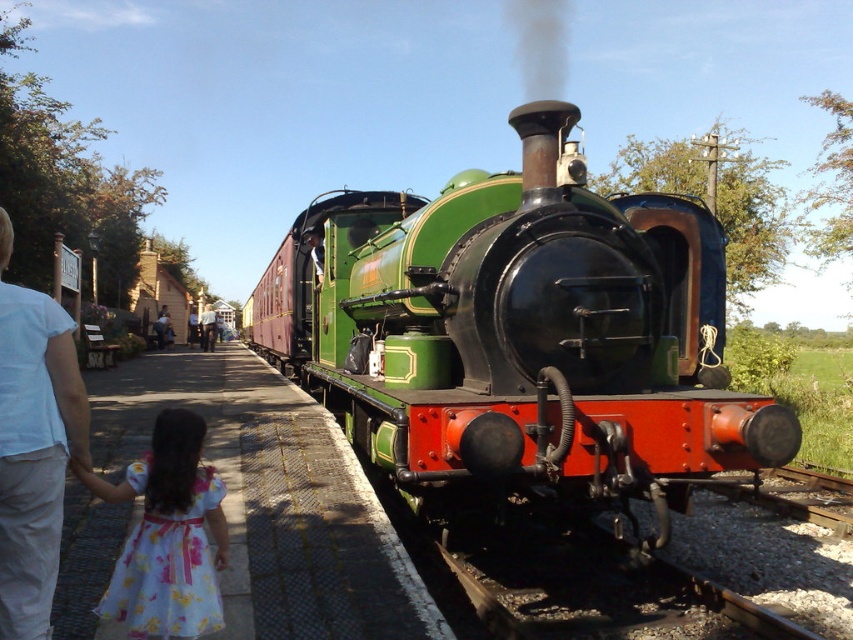
From the picture: Who is higher up, white cotton shirt at left or light brown wooden sign at center?

Positioned higher is light brown wooden sign at center.

Find the location of a particular element. This screenshot has width=853, height=640. white cotton shirt at left is located at coordinates (33, 445).

The width and height of the screenshot is (853, 640). In order to click on white cotton shirt at left in this screenshot , I will do `click(33, 445)`.

Is point (18, 324) behind point (115, 576)?

No, (18, 324) is closer to viewer.

Looking at this image, can you confirm if white cotton shirt at left is wider than floral cotton dress at lower left?

Yes, white cotton shirt at left is wider than floral cotton dress at lower left.

Does point (38, 333) come closer to viewer compared to point (154, 602)?

Yes.

At what (x,y) coordinates should I click in order to perform the action: click on white cotton shirt at left. Please return your answer as a coordinate pair (x, y). Looking at the image, I should click on (33, 445).

Which of these two, green polished wood train at center or white cotton shirt at left, stands taller?

Standing taller between the two is green polished wood train at center.

Is green polished wood train at center shorter than white cotton shirt at left?

No.

Measure the distance between green polished wood train at center and camera.

green polished wood train at center and camera are 14.55 feet apart.

Locate an element on the screen. green polished wood train at center is located at coordinates (521, 337).